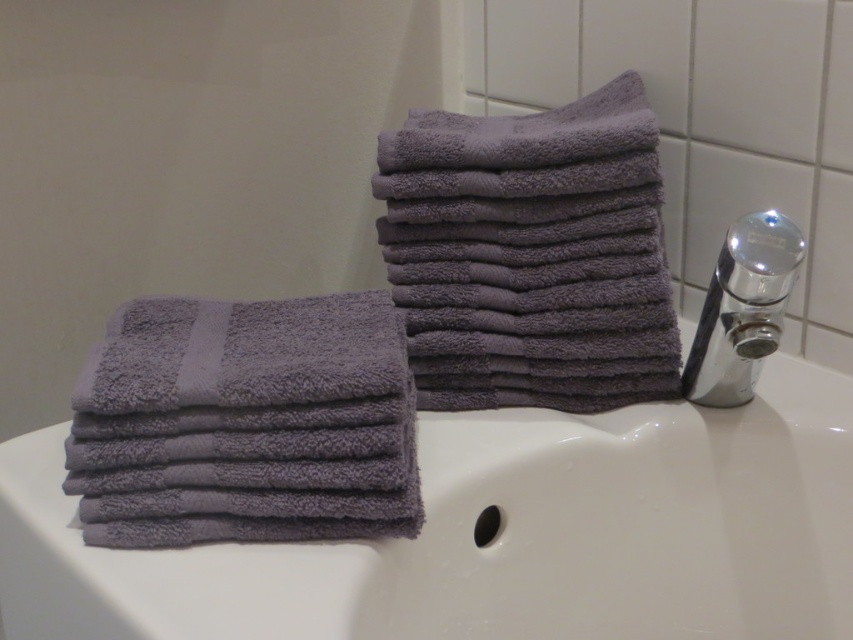
You are organizing towels in a bathroom and see the purple terry cloth towels at upper right and the chrome metallic faucet at upper right. Which object is closer to the left side of the bathroom sink?

The purple terry cloth towels at upper right are to the left of the chrome metallic faucet at upper right, so they are closer to the left side of the bathroom sink.

You are designing a bathroom layout and need to place a decorative item between the purple terry cloth towels at upper right and the chrome metallic faucet at upper right. Based on their sizes, which object should you place closer to the edge to ensure stability?

The purple terry cloth towels at upper right are wider than the chrome metallic faucet at upper right, so placing the decorative item closer to the towels would provide a more stable base due to their larger width.